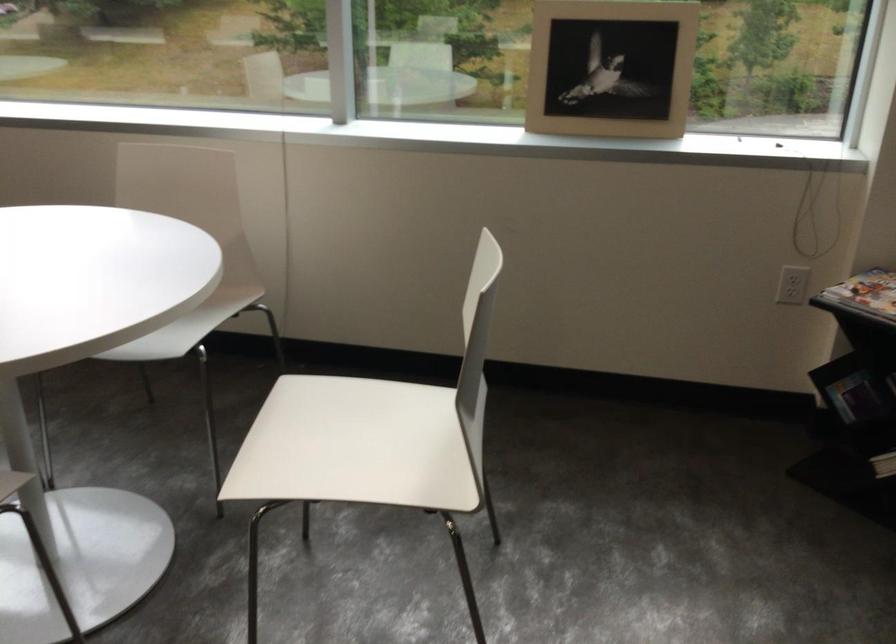
Find where to lift the magazine on rack. Please return your answer as a coordinate pair (x, y).

(865, 295)